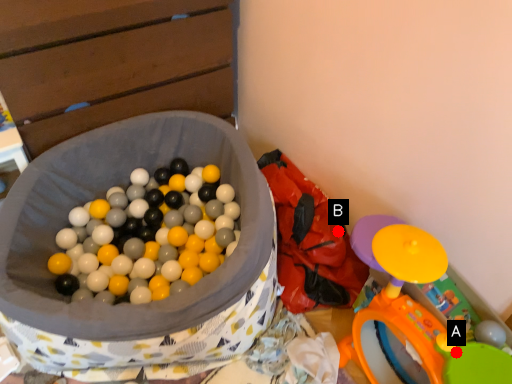
Question: Two points are circled on the image, labeled by A and B beside each circle. Which point is farther to the camera?

Choices:
 (A) A is further
 (B) B is further

Answer: (B)